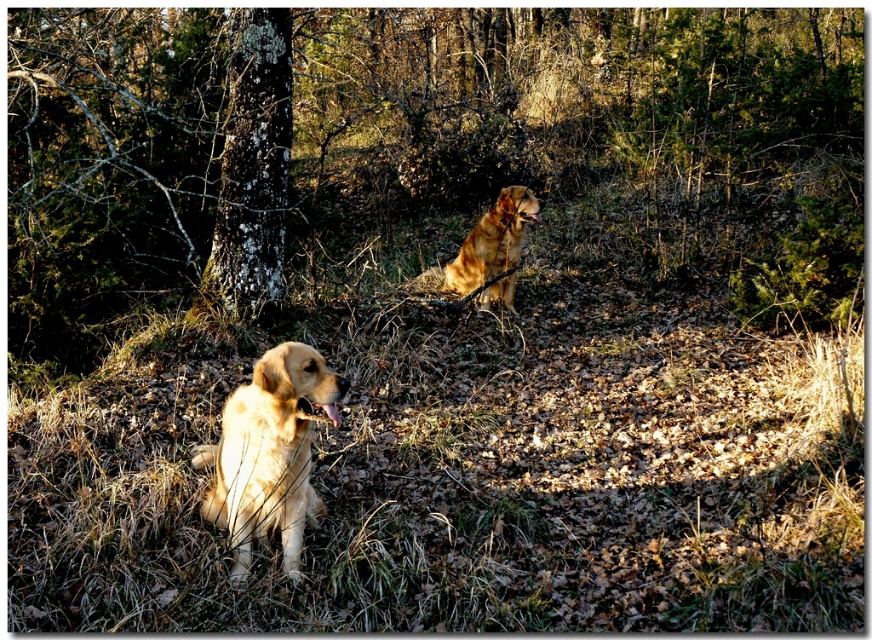
You are a photographer trying to capture a photo of the golden fur dog at center. You notice the smooth bark tree at center might block the view. Based on their positions, can you determine if the tree is in front of or behind the dog?

The smooth bark tree at center is to the left of the golden fur dog at center, so the tree is positioned to the left side of the dog and not blocking the view directly in front. Therefore, the tree is not in front of the dog but to its left side.

You are a photographer trying to capture both the smooth bark tree at center and the golden fur dog at center in a single shot. Based on their positions, which one is closer to the camera?

The smooth bark tree at center is closer to the camera because it is positioned in front of the golden fur dog at center.